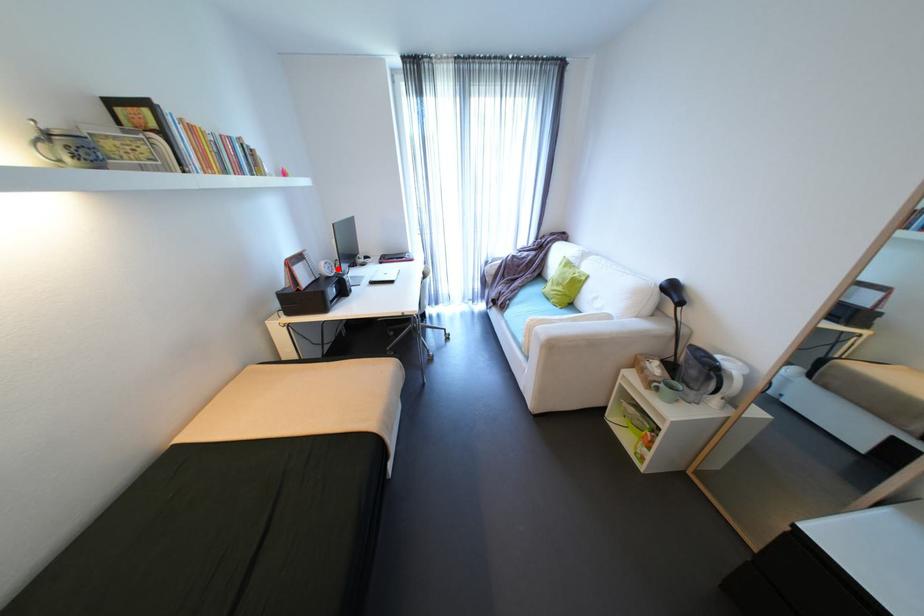
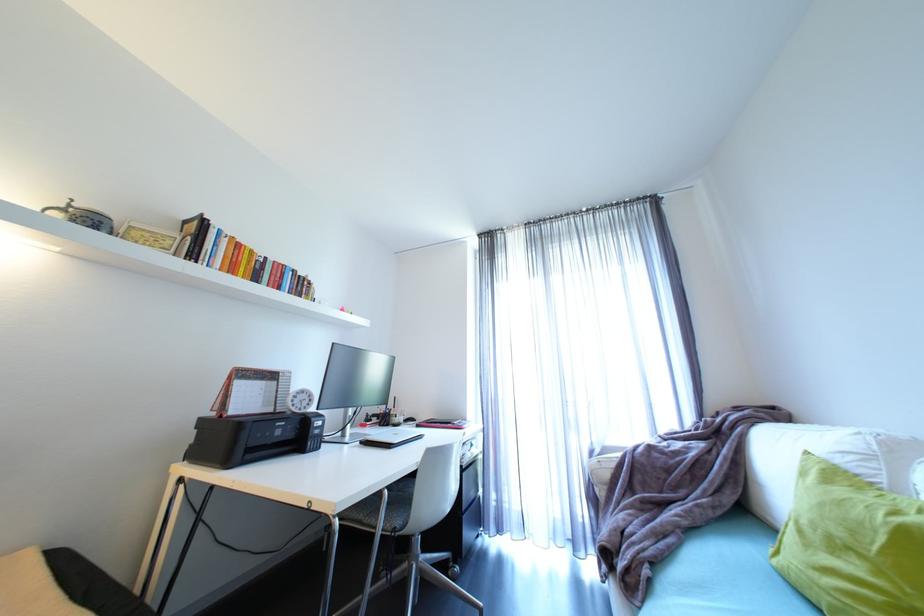
In the second image, find the point that corresponds to the highlighted location in the first image.

(312, 402)